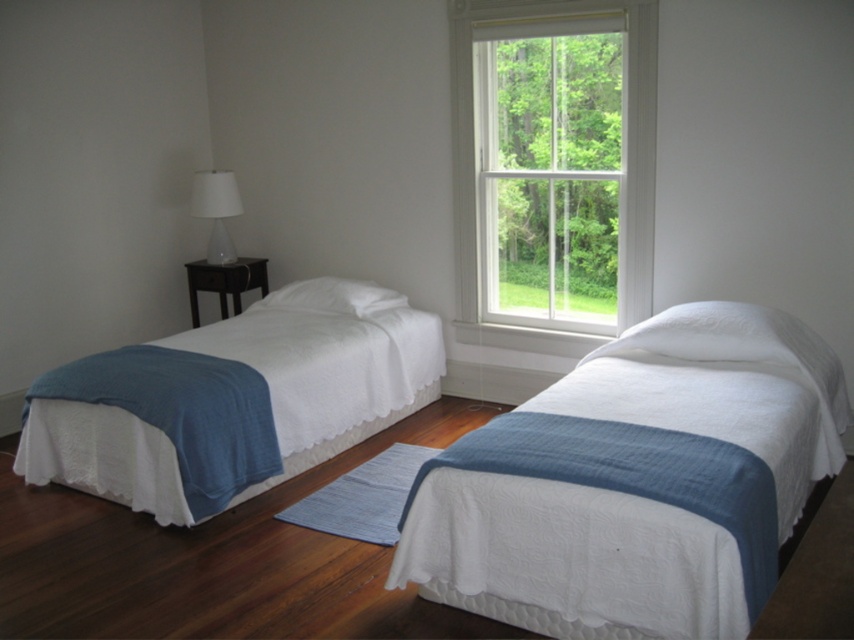
You are standing at the entrance of the bedroom and want to check if you can reach the clear glass window at center from your current position. The room is 4 meters long from the entrance to the wall with the window. Can you reach the window without moving further into the room?

The clear glass window at center is 3.77 meters from the camera. Since the room is 4 meters long from the entrance to the wall with the window, you can reach the window without moving further into the room because the distance to the window is shorter than the total room length.

You are standing at the entrance of the bedroom and want to walk straight to the white soft pillow at center. Which side of the white quilted bed at left will you pass by on your way?

Since the white quilted bed at left is to the left of the white soft pillow at center, you will pass by the right side of the white quilted bed at left on your way to the white soft pillow at center.

Consider the image. You are trying to decide whether to place a large decorative item on the white quilted bed at center or the white soft pillow at center. Based on their sizes, which one can better accommodate the item?

The white quilted bed at center is bigger than the white soft pillow at center, so it can better accommodate the large decorative item.